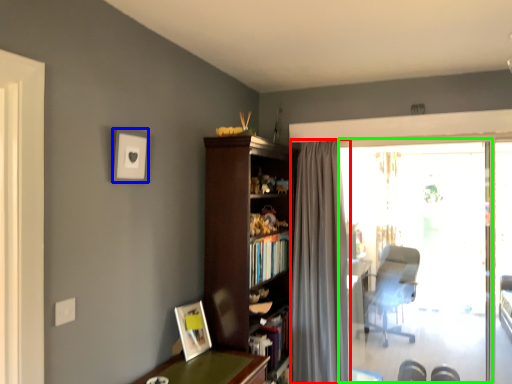
Question: Which object is positioned farthest from curtain (highlighted by a red box)? Select from picture frame (highlighted by a blue box) and window screen (highlighted by a green box).

Choices:
 (A) picture frame
 (B) window screen

Answer: (B)